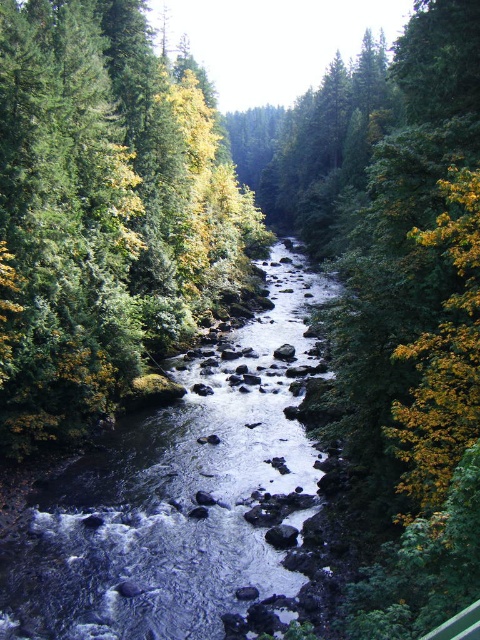
Is green matte tree at center to the right of clear water at center from the viewer's perspective?

Incorrect, green matte tree at center is not on the right side of clear water at center.

Identify the location of green matte tree at center. (103, 211).